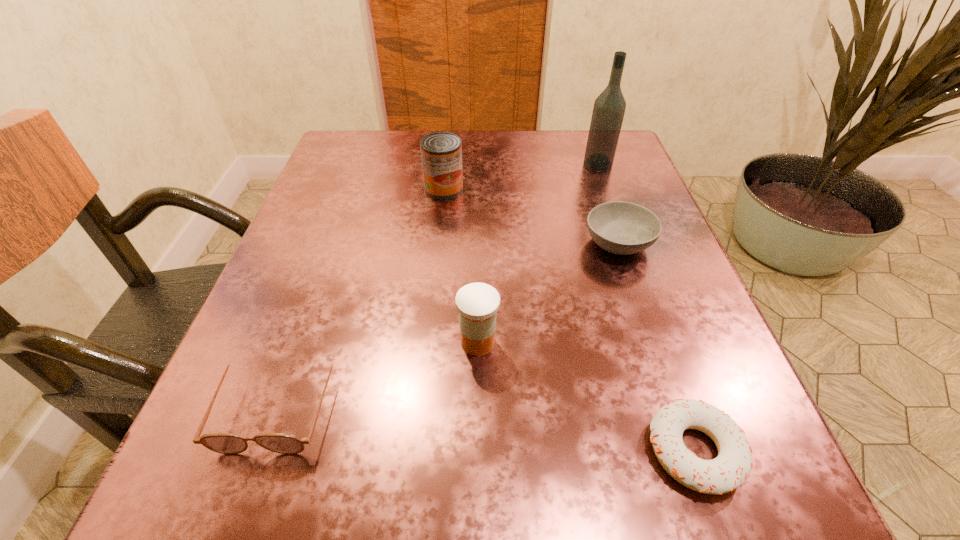
You are a GUI agent. You are given a task and a screenshot of the screen. Output one action in this format:
    pyautogui.click(x=<x>, y=<y>)
    Task: Click on the free region located 0.070m on the label of the third object from left to right
    
    Given the screenshot: What is the action you would take?
    pyautogui.click(x=546, y=342)

Find the location of a particular element. free space located 0.190m on the back of the bowl is located at coordinates (593, 169).

The height and width of the screenshot is (540, 960). Find the location of `free space located 0.090m on the back of the shortest object`. free space located 0.090m on the back of the shortest object is located at coordinates (660, 351).

Identify the location of vodka that is at the far edge. The width and height of the screenshot is (960, 540). pos(609,108).

You are a GUI agent. You are given a task and a screenshot of the screen. Output one action in this format:
    pyautogui.click(x=<x>, y=<y>)
    Task: Click on the can present at the far edge
    Image resolution: width=960 pixels, height=540 pixels.
    Given the screenshot: What is the action you would take?
    pyautogui.click(x=441, y=152)

Locate an element on the screen. Image resolution: width=960 pixels, height=540 pixels. sunglasses present at the near edge is located at coordinates (224, 443).

The height and width of the screenshot is (540, 960). In order to click on doughnut situated at the near edge in this screenshot , I will do pyautogui.click(x=731, y=468).

Identify the location of object situated at the left edge. This screenshot has width=960, height=540. (224, 443).

The width and height of the screenshot is (960, 540). Find the location of `vodka at the right edge`. vodka at the right edge is located at coordinates (609, 108).

Find the location of a particular element. bowl present at the right edge is located at coordinates (619, 227).